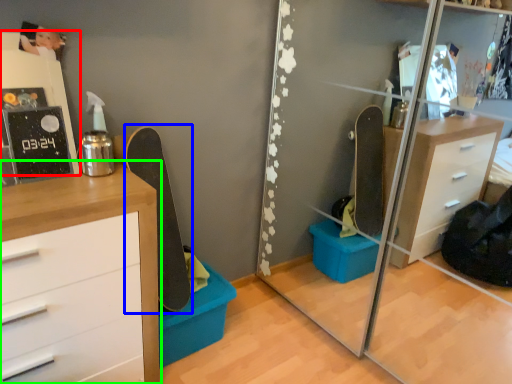
Question: Estimate the real-world distances between objects in this image. Which object is closer to shelf (highlighted by a red box), skateboard (highlighted by a blue box) or chest of drawers (highlighted by a green box)?

Choices:
 (A) skateboard
 (B) chest of drawers

Answer: (B)